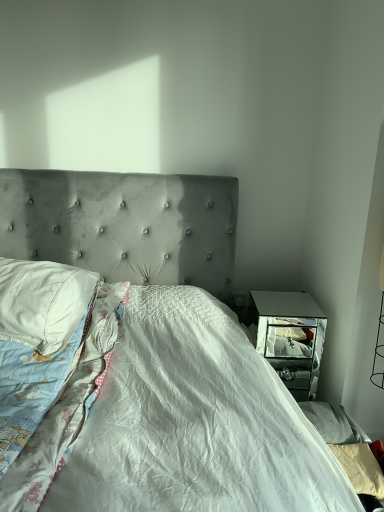
Question: Is white cotton blanket at left facing away from velvet gray bed at center?

Choices:
 (A) yes
 (B) no

Answer: (A)

Question: Can you confirm if white cotton blanket at left is taller than velvet gray bed at center?

Choices:
 (A) yes
 (B) no

Answer: (B)

Question: Is white cotton blanket at left directly adjacent to velvet gray bed at center?

Choices:
 (A) no
 (B) yes

Answer: (A)

Question: Considering the relative sizes of white cotton blanket at left and velvet gray bed at center in the image provided, is white cotton blanket at left thinner than velvet gray bed at center?

Choices:
 (A) yes
 (B) no

Answer: (A)

Question: From a real-world perspective, does white cotton blanket at left sit lower than velvet gray bed at center?

Choices:
 (A) yes
 (B) no

Answer: (A)

Question: Is white cotton blanket at left positioned far away from velvet gray bed at center?

Choices:
 (A) yes
 (B) no

Answer: (B)

Question: Is there a large distance between white cotton pillow at left and white cotton blanket at left?

Choices:
 (A) yes
 (B) no

Answer: (B)

Question: From a real-world perspective, is white cotton pillow at left beneath white cotton blanket at left?

Choices:
 (A) no
 (B) yes

Answer: (A)

Question: Is white cotton pillow at left beside white cotton blanket at left?

Choices:
 (A) no
 (B) yes

Answer: (A)

Question: Can you confirm if white cotton pillow at left is thinner than white cotton blanket at left?

Choices:
 (A) yes
 (B) no

Answer: (A)

Question: Does white cotton pillow at left appear on the left side of white cotton blanket at left?

Choices:
 (A) yes
 (B) no

Answer: (A)

Question: Is white cotton pillow at left positioned with its back to white cotton blanket at left?

Choices:
 (A) yes
 (B) no

Answer: (A)

Question: Does velvet gray bed at center come behind white cotton pillow at left?

Choices:
 (A) no
 (B) yes

Answer: (A)